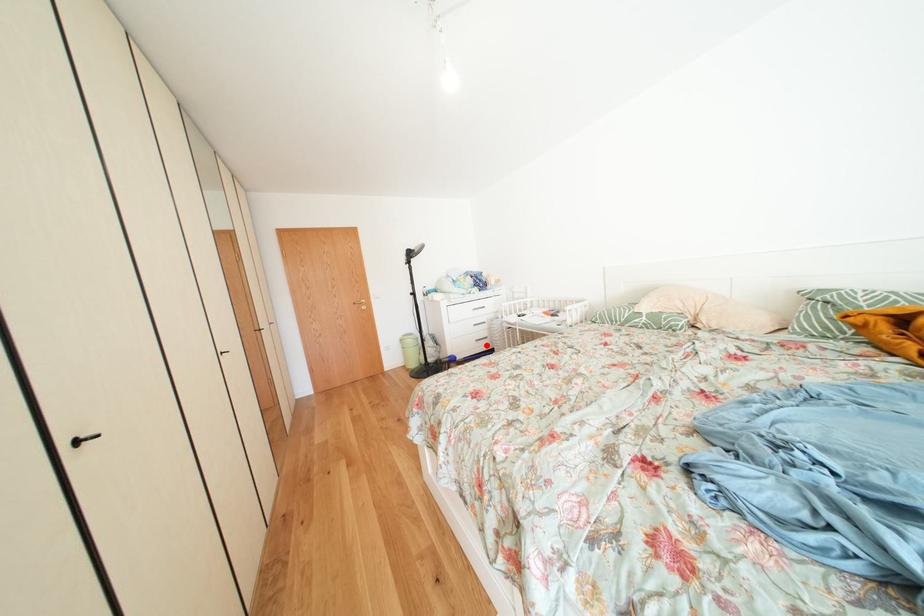
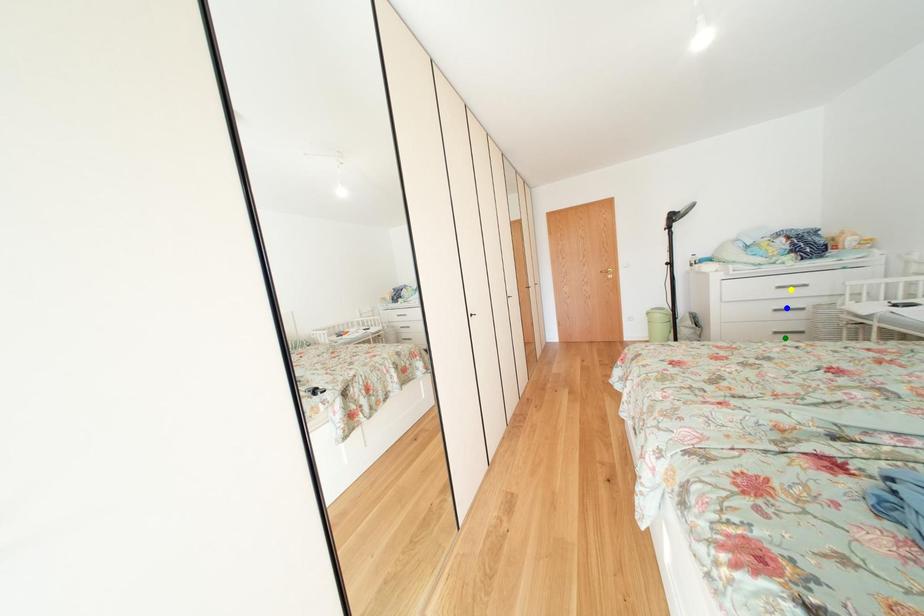
Question: I am providing you with two images of the same scene from different viewpoints. A red point is marked on the first image. You are given multiple points on the second image. Which mark in image 2 goes with the point in image 1?

Choices:
 (A) blue point
 (B) yellow point
 (C) green point

Answer: (C)